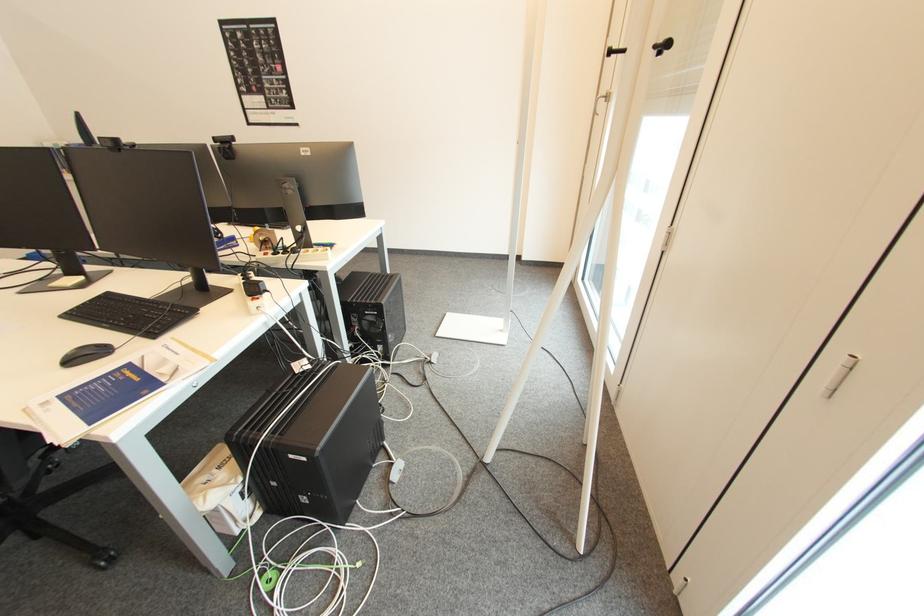
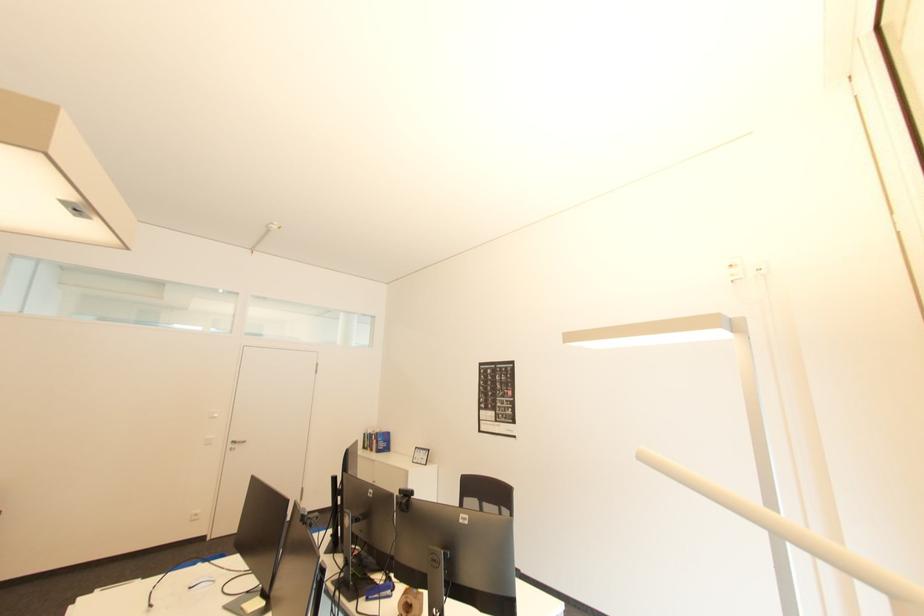
How did the camera likely rotate?

The camera's rotation is toward left-up.